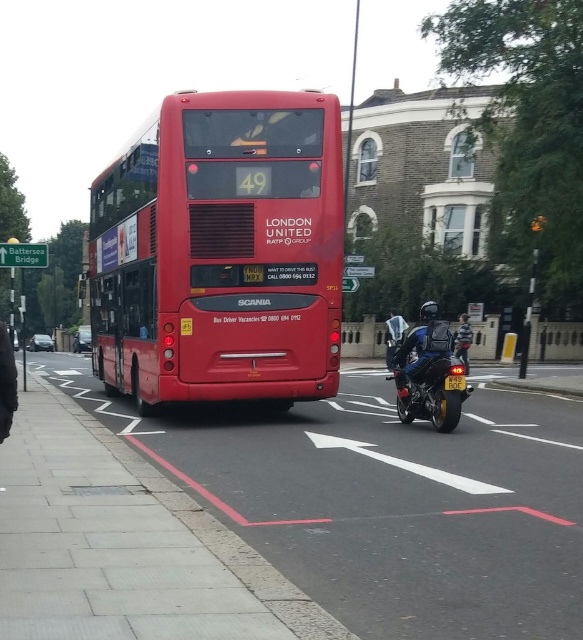
Question: Is shiny blue motorcycle at right to the right of shiny blue motorcycle at center from the viewer's perspective?

Choices:
 (A) no
 (B) yes

Answer: (A)

Question: Among these points, which one is farthest from the camera?

Choices:
 (A) (447, 388)
 (B) (405, 374)

Answer: (B)

Question: Does shiny blue motorcycle at center come behind yellow matte license plate at center?

Choices:
 (A) yes
 (B) no

Answer: (A)

Question: Which point appears closest to the camera in this image?

Choices:
 (A) click(x=458, y=378)
 (B) click(x=209, y=376)
 (C) click(x=398, y=387)

Answer: (A)

Question: Considering the real-world distances, which object is closest to the yellow matte license plate at center?

Choices:
 (A) shiny blue motorcycle at center
 (B) matte red bus at center
 (C) shiny blue motorcycle at right

Answer: (C)

Question: Can you confirm if matte red bus at center is bigger than shiny blue motorcycle at center?

Choices:
 (A) no
 (B) yes

Answer: (B)